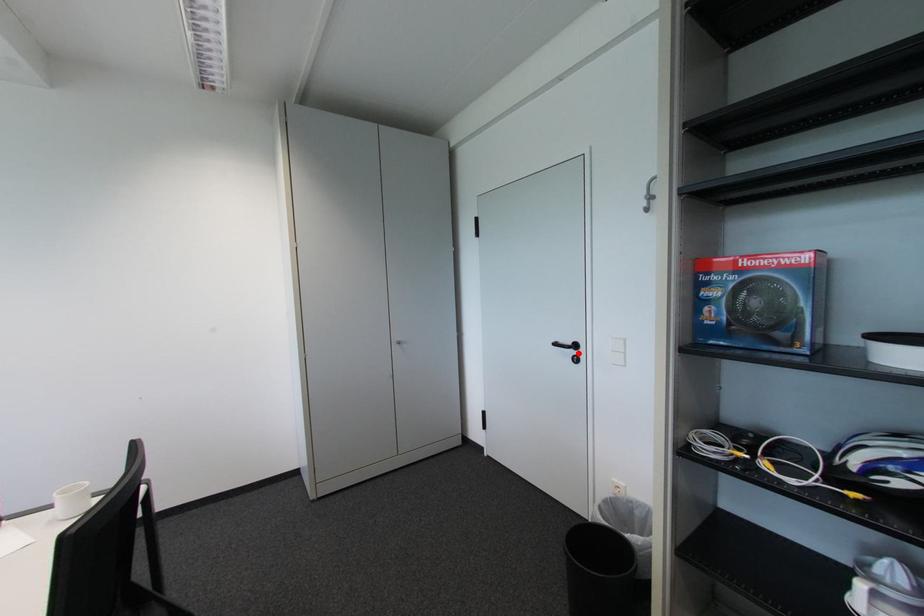
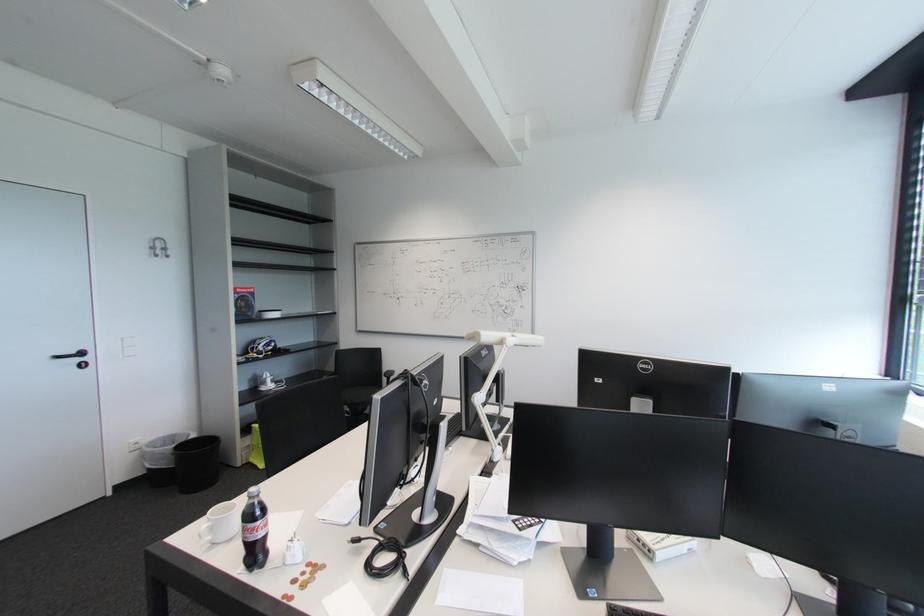
Where in the second image is the point corresponding to the highlighted location from the first image?

(83, 361)